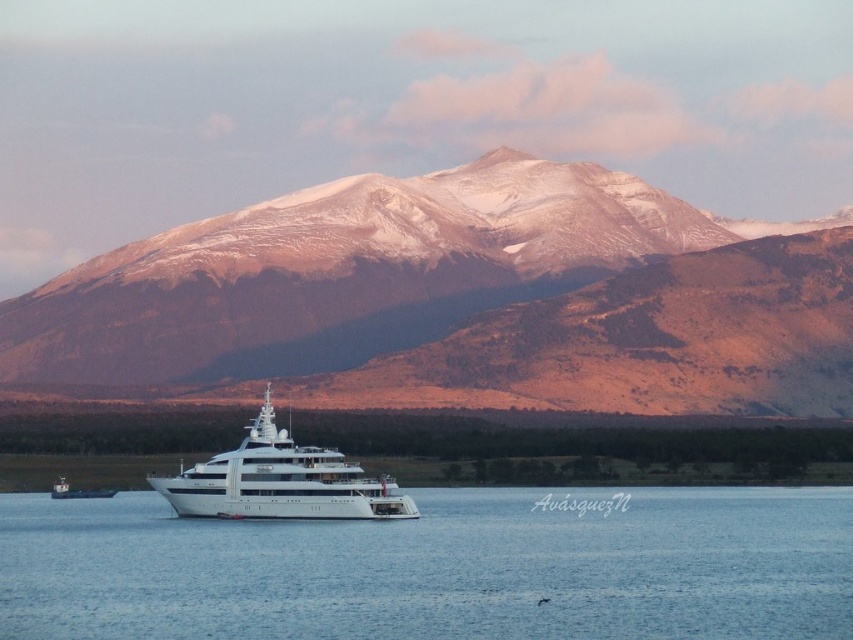
What does the point at coordinates (451,301) on the image represent?

The point at coordinates (451,301) corresponds to the snowy mountain range at center.

In the scene shown: You are a photographer planning to capture the snowy mountain range at center and the clear blue water at center in a single frame. Based on the scene, which object will occupy more horizontal space in your photo?

The snowy mountain range at center has a greater width than the clear blue water at center, so it will occupy more horizontal space in the photo.

You are a photographer planning to capture the snowy mountain range at center and the clear blue water at center in a single frame. Based on their sizes in the image, which object will occupy more of the frame?

The snowy mountain range at center is larger in size than the clear blue water at center, so it will occupy more of the frame.